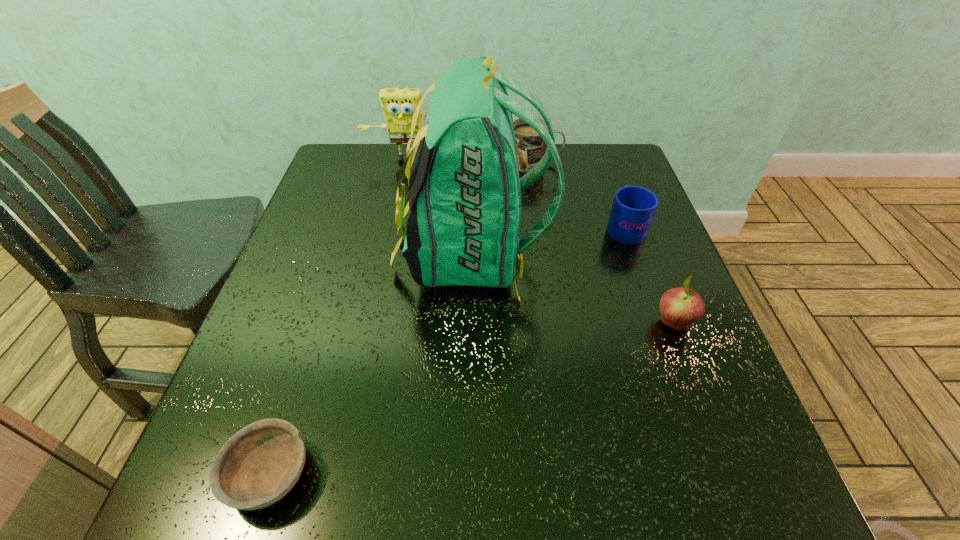
Find the location of a particular element. The width and height of the screenshot is (960, 540). the tallest object is located at coordinates (463, 226).

In order to click on sponge in this screenshot , I will do `click(398, 105)`.

You are a GUI agent. You are given a task and a screenshot of the screen. Output one action in this format:
    pyautogui.click(x=<x>, y=<y>)
    Task: Click on the farther mug
    The image size is (960, 540).
    Given the screenshot: What is the action you would take?
    pyautogui.click(x=530, y=147)

The width and height of the screenshot is (960, 540). I want to click on the second nearest object, so click(681, 306).

This screenshot has width=960, height=540. What are the coordinates of `the shorter mug` in the screenshot? It's located at (633, 208).

In order to click on the right mug in this screenshot , I will do 633,208.

Locate an element on the screen. This screenshot has width=960, height=540. bowl is located at coordinates (256, 467).

Where is `the shortest object`? This screenshot has height=540, width=960. the shortest object is located at coordinates (256, 467).

This screenshot has height=540, width=960. Find the location of `vacant space located 0.090m on the back of the backpack`. vacant space located 0.090m on the back of the backpack is located at coordinates (586, 254).

The image size is (960, 540). Identify the location of free spot located 0.290m on the face of the fifth shortest object. (393, 234).